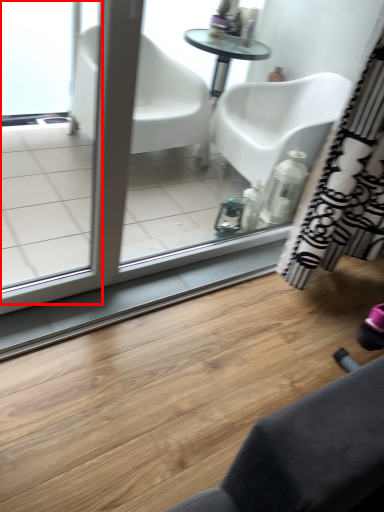
Question: Where is screen door (annotated by the red box) located in relation to curtain in the image?

Choices:
 (A) right
 (B) left

Answer: (B)